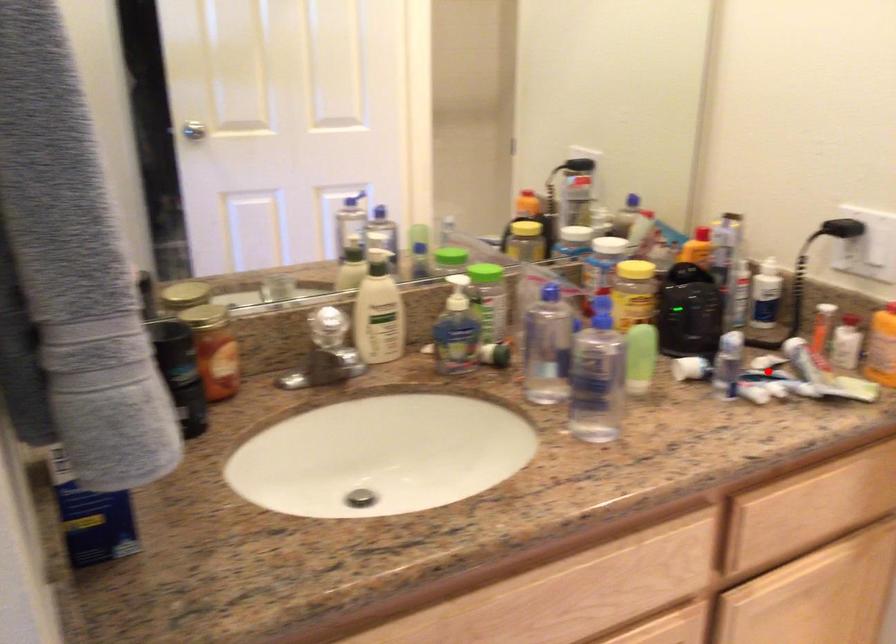
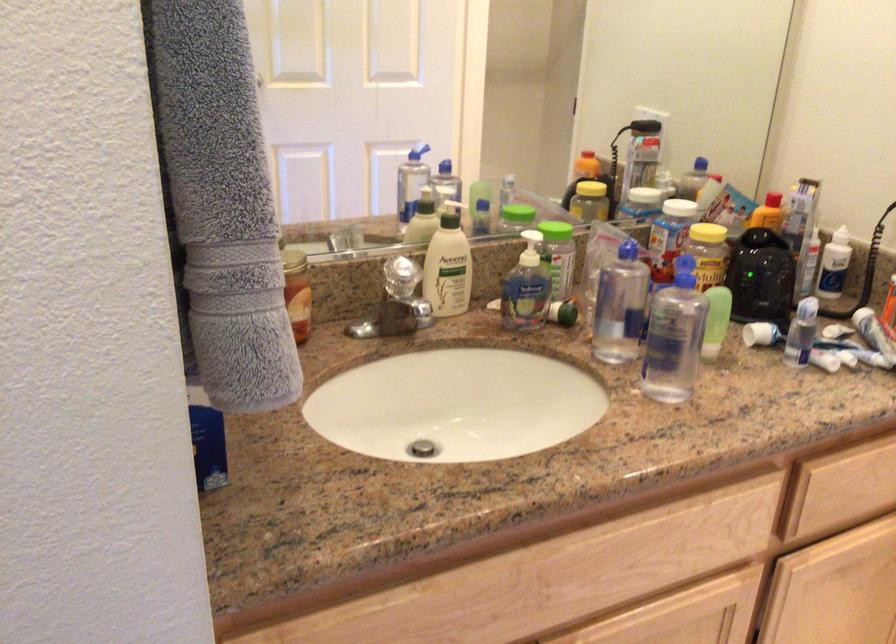
Where in the second image is the point corresponding to the highlighted location from the first image?

(839, 339)